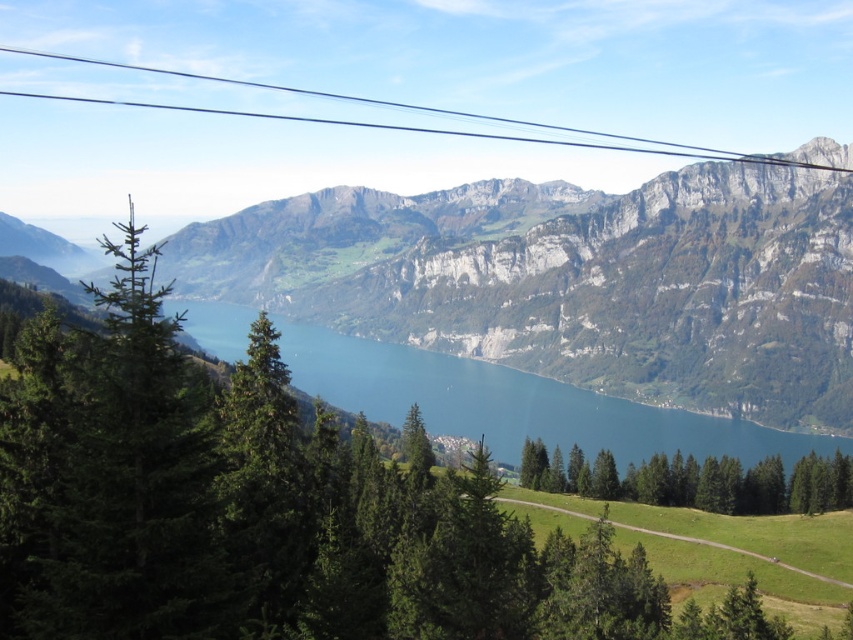
In the scene shown: You are standing at the point labeled as point (x=695, y=481) in the image. What is the nearest object to you in the scene?

The nearest object to you at point (x=695, y=481) is the green matte tree at center.

You are planning to hang a decorative banner between the green matte tree at center and the black wire at upper center. Based on their sizes, which object would require more space for the banner?

The black wire at upper center requires more space for the banner because it occupies more space than the green matte tree at center.